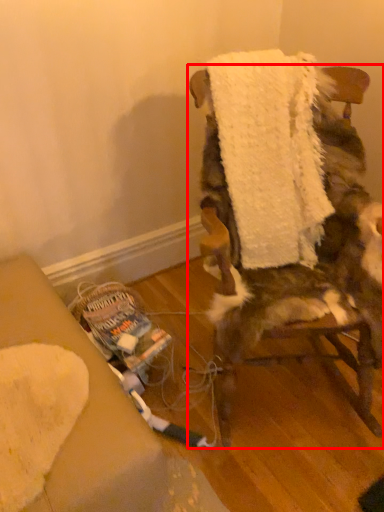
Question: Where is chair (annotated by the red box) located in relation to bath towel in the image?

Choices:
 (A) left
 (B) right

Answer: (B)